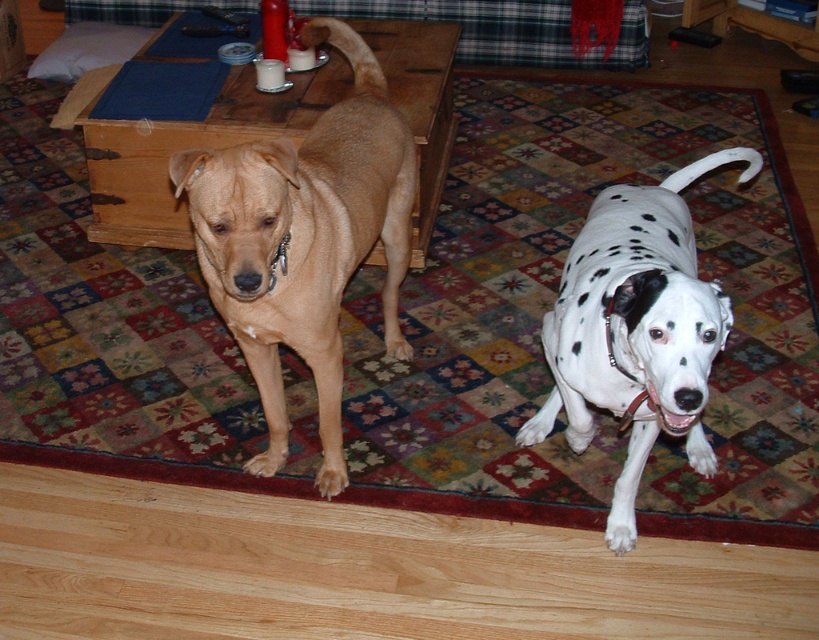
Is light brown fur at center below matte tan dog at center?

Indeed, light brown fur at center is positioned under matte tan dog at center.

Between light brown fur at center and matte tan dog at center, which one has less height?

With less height is matte tan dog at center.

Locate an element on the screen. The height and width of the screenshot is (640, 819). light brown fur at center is located at coordinates (305, 241).

In the scene shown: Who is taller, light brown fur at center or white-spotted fur at center?

With more height is light brown fur at center.

Can you confirm if light brown fur at center is positioned below white-spotted fur at center?

Actually, light brown fur at center is above white-spotted fur at center.

Does point (269, 241) lie behind point (587, 326)?

No, (269, 241) is closer to viewer.

Where is `light brown fur at center`? light brown fur at center is located at coordinates (305, 241).

Is white-spotted fur at center further to camera compared to matte tan dog at center?

No, white-spotted fur at center is in front of matte tan dog at center.

Who is more distant from viewer, (x=672, y=426) or (x=424, y=148)?

Positioned behind is point (x=424, y=148).

Find the location of a particular element. This screenshot has width=819, height=640. white-spotted fur at center is located at coordinates (636, 330).